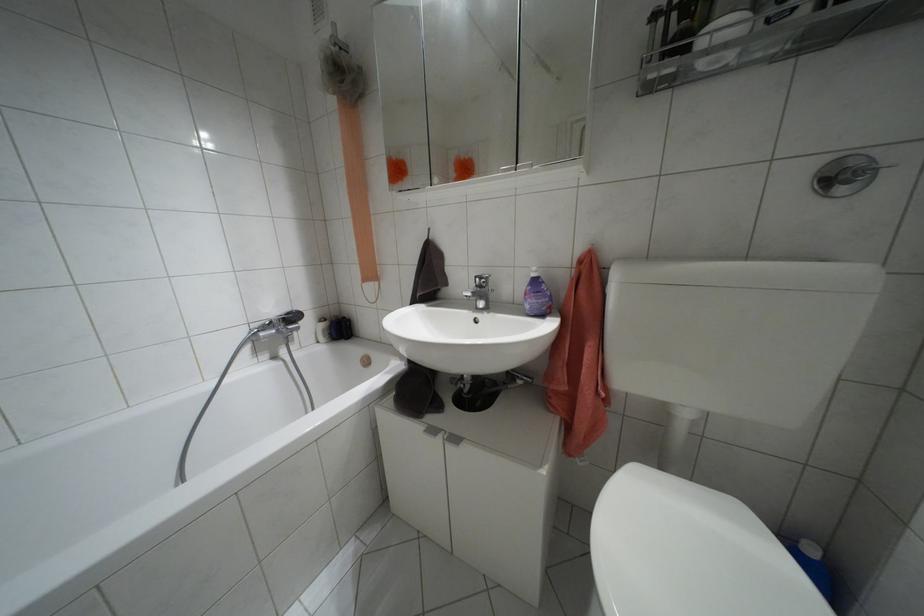
The height and width of the screenshot is (616, 924). Describe the element at coordinates (845, 175) in the screenshot. I see `the toilet flush button` at that location.